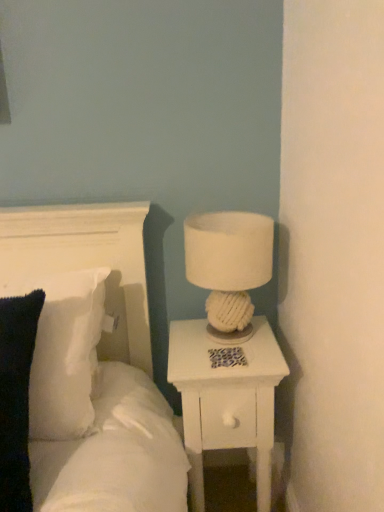
Where is `vacant space situated above white wood nightstand at right (from a real-world perspective)`? vacant space situated above white wood nightstand at right (from a real-world perspective) is located at coordinates (221, 347).